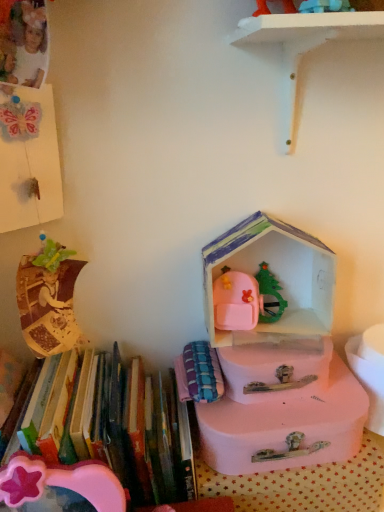
Locate an element on the screen. blank space above pink plastic suitcase at center, which ranks as the second storage box in top-to-bottom order (from a real-world perspective) is located at coordinates (283, 396).